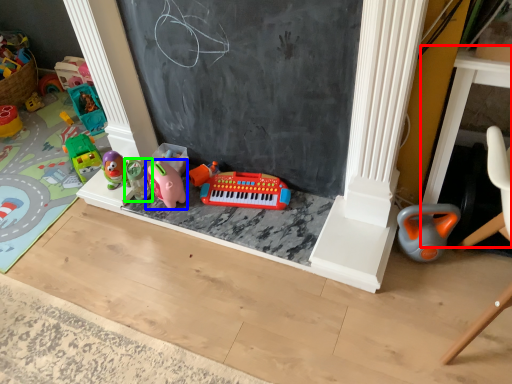
Question: Based on their relative distances, which object is nearer to table (highlighted by a red box)? Choose from toy (highlighted by a blue box) and toy (highlighted by a green box).

Choices:
 (A) toy
 (B) toy

Answer: (A)